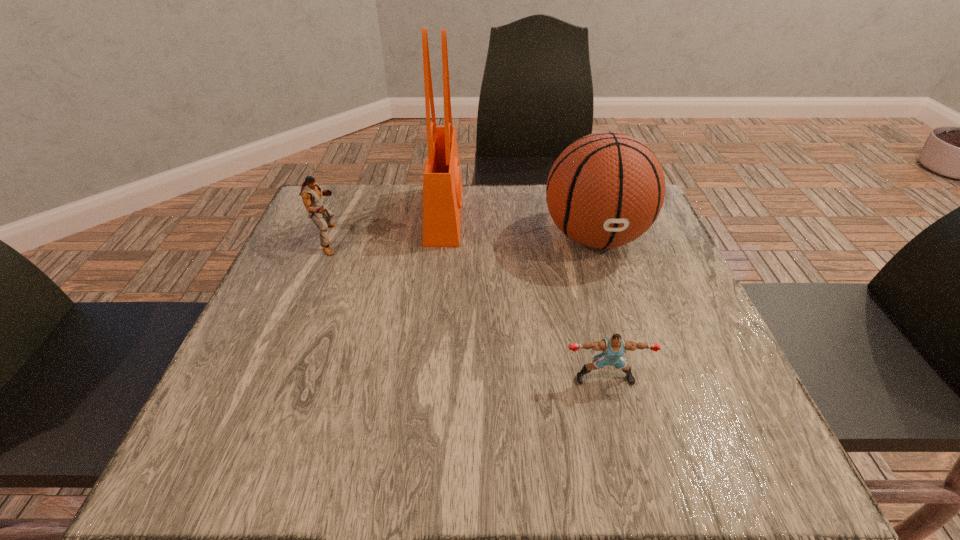
I want to click on free spot between the basketball and the taller puncher, so click(x=462, y=238).

At what (x,y) coordinates should I click in order to perform the action: click on empty space that is in between the second tallest object and the left puncher. Please return your answer as a coordinate pair (x, y). The image size is (960, 540). Looking at the image, I should click on (462, 238).

The height and width of the screenshot is (540, 960). I want to click on free space between the shorter puncher and the third shortest object, so coord(599,307).

Where is `free space that is in between the second object from left to right and the basketball`? The image size is (960, 540). free space that is in between the second object from left to right and the basketball is located at coordinates (519, 226).

Locate an element on the screen. Image resolution: width=960 pixels, height=540 pixels. vacant region between the third tallest object and the basketball is located at coordinates (462, 238).

Identify the location of object that is the second nearest to the basketball. This screenshot has width=960, height=540. (614, 347).

You are a GUI agent. You are given a task and a screenshot of the screen. Output one action in this format:
    pyautogui.click(x=<x>, y=<y>)
    Task: Click on the object that is the second closest to the right puncher
    The height and width of the screenshot is (540, 960).
    Given the screenshot: What is the action you would take?
    pyautogui.click(x=442, y=185)

Locate an element on the screen. blank area in the image that satisfies the following two spatial constraints: 1. on the side where the inflation valve is located; 2. on the front-facing side of the third tallest object is located at coordinates (595, 239).

This screenshot has height=540, width=960. I want to click on vacant area that satisfies the following two spatial constraints: 1. on the side where the inflation valve is located; 2. on the front-facing side of the taller puncher, so [x=595, y=239].

Find the location of a particular element. blank area in the image that satisfies the following two spatial constraints: 1. on the side where the inflation valve is located; 2. on the front-facing side of the farther puncher is located at coordinates (595, 239).